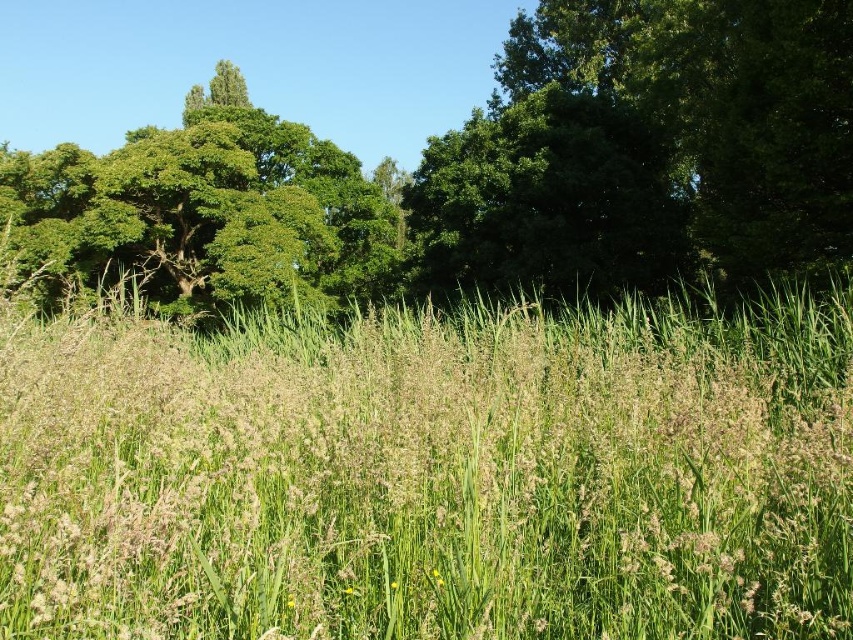
Between point (479, 433) and point (223, 241), which one is positioned behind?

Positioned behind is point (223, 241).

Is green grassy field at center smaller than green leafy tree at upper left?

Indeed, green grassy field at center has a smaller size compared to green leafy tree at upper left.

You are a GUI agent. You are given a task and a screenshot of the screen. Output one action in this format:
    pyautogui.click(x=<x>, y=<y>)
    Task: Click on the green grassy field at center
    This screenshot has width=853, height=640.
    Given the screenshot: What is the action you would take?
    pyautogui.click(x=430, y=477)

Who is positioned more to the left, green grassy field at center or green leafy tree at upper center?

Positioned to the left is green leafy tree at upper center.

What do you see at coordinates (430, 477) in the screenshot?
I see `green grassy field at center` at bounding box center [430, 477].

Describe the element at coordinates (430, 477) in the screenshot. I see `green grassy field at center` at that location.

This screenshot has height=640, width=853. Identify the location of green grassy field at center. (430, 477).

Does point (654, 35) lie behind point (218, 276)?

No, (654, 35) is in front of (218, 276).

Can you confirm if green leafy tree at upper center is positioned above green leafy tree at upper left?

No, green leafy tree at upper center is not above green leafy tree at upper left.

At what (x,y) coordinates should I click in order to perform the action: click on green leafy tree at upper center. Please return your answer as a coordinate pair (x, y). This screenshot has width=853, height=640. Looking at the image, I should click on (486, 172).